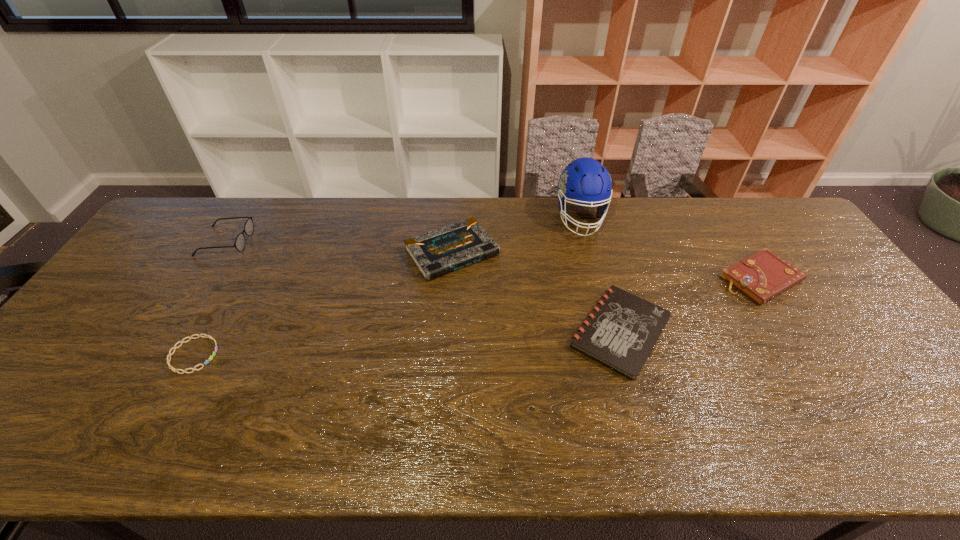
Find the location of a particular element. Image resolution: width=960 pixels, height=540 pixels. vacant space at the far left corner of the desktop is located at coordinates (217, 197).

In the image, there is a desktop. At what (x,y) coordinates should I click in order to perform the action: click on free space at the near right corner. Please return your answer as a coordinate pair (x, y). This screenshot has height=540, width=960. Looking at the image, I should click on (942, 427).

I want to click on free space between the third object from left to right and the spectacles, so click(339, 247).

Image resolution: width=960 pixels, height=540 pixels. In order to click on free point between the rightmost notebook and the fifth tallest object in this screenshot , I will do `click(690, 305)`.

The height and width of the screenshot is (540, 960). In order to click on free space between the rightmost notebook and the shortest notebook in this screenshot , I will do `click(690, 305)`.

Where is `vacant area between the rightmost object and the shortest object`? The height and width of the screenshot is (540, 960). vacant area between the rightmost object and the shortest object is located at coordinates (477, 317).

At what (x,y) coordinates should I click in order to perform the action: click on unoccupied position between the fifth shortest object and the rightmost object. Please return your answer as a coordinate pair (x, y). Looking at the image, I should click on (493, 260).

In order to click on vacant point located between the football helmet and the rightmost notebook in this screenshot , I will do `click(670, 248)`.

The image size is (960, 540). Identify the location of empty space between the fifth shortest object and the rightmost object. [493, 260].

At what (x,y) coordinates should I click in order to perform the action: click on empty space between the spectacles and the tallest object. Please return your answer as a coordinate pair (x, y). The width and height of the screenshot is (960, 540). Looking at the image, I should click on (403, 230).